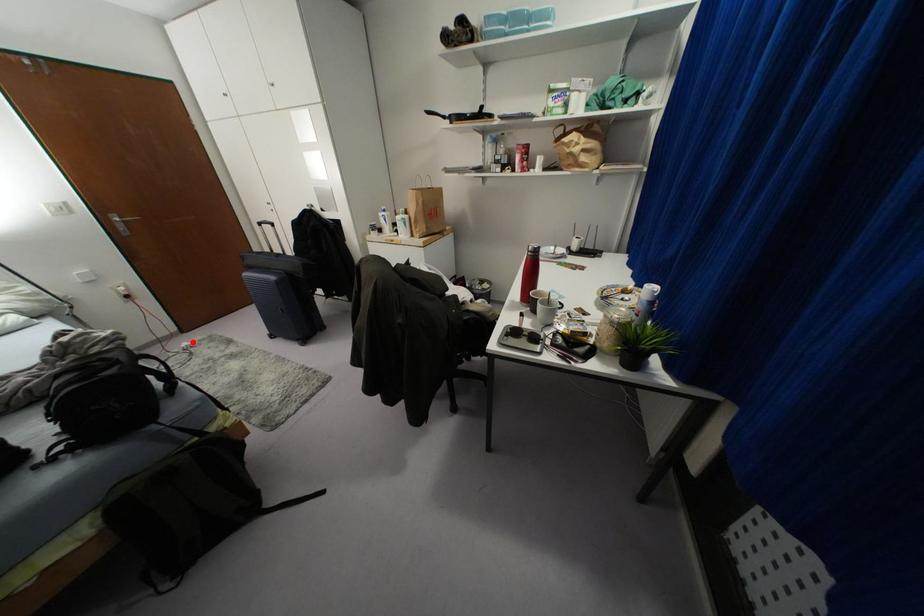
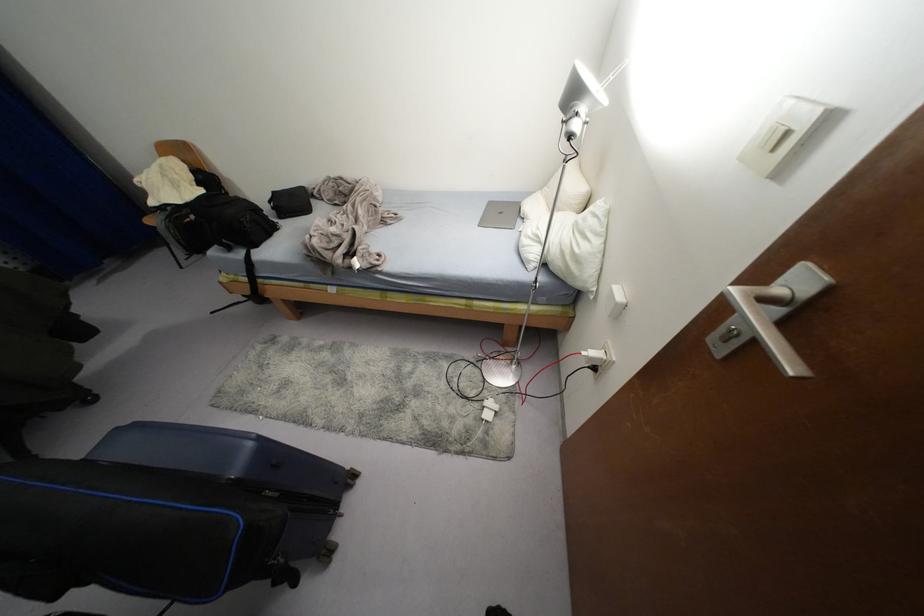
Question: I am providing you with two images of the same scene from different viewpoints. Image1 has a red point marked. In image2, the corresponding 3D location appears at what relative position? Reply with the corresponding letter.

Choices:
 (A) Closer
 (B) Farther

Answer: (B)